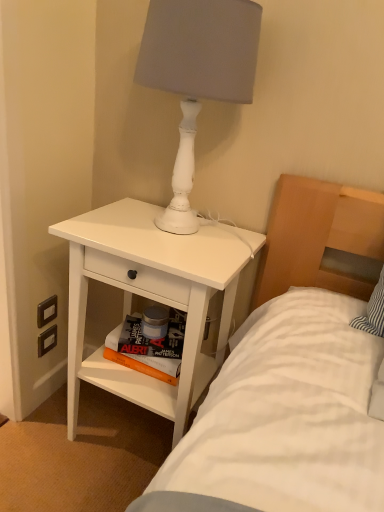
Question: Relative to hardcover book at lower center, which is counted as the first magazine, starting from the top, is white matte lamp at upper right in front or behind?

Choices:
 (A) behind
 (B) front

Answer: (B)

Question: From a real-world perspective, is white matte lamp at upper right physically located above or below hardcover book at lower center, the 2th magazine positioned from the bottom?

Choices:
 (A) below
 (B) above

Answer: (B)

Question: Considering the real-world distances, which object is closest to the white matte nightstand at lower left?

Choices:
 (A) orange matte book at lower center, the first magazine in the bottom-to-top sequence
 (B) matte white switch at lower left, marked as the 2th electric outlet in a bottom-to-top arrangement
 (C) black plastic electric outlet at lower left, the second electric outlet positioned from the top
 (D) white matte lamp at upper right
 (E) hardcover book at lower center, which is counted as the first magazine, starting from the top

Answer: (A)

Question: Which object is positioned closest to the white matte lamp at upper right?

Choices:
 (A) matte white switch at lower left, marked as the 2th electric outlet in a bottom-to-top arrangement
 (B) white matte nightstand at lower left
 (C) black plastic electric outlet at lower left, the 1th electric outlet from the bottom
 (D) orange matte book at lower center, which is the 2th magazine from top to bottom
 (E) hardcover book at lower center, the 2th magazine positioned from the bottom

Answer: (B)